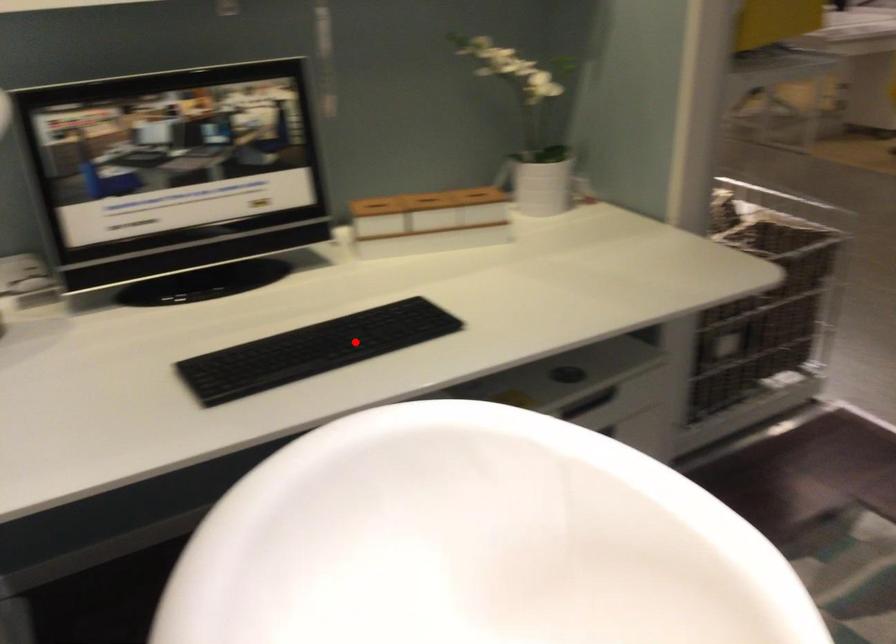
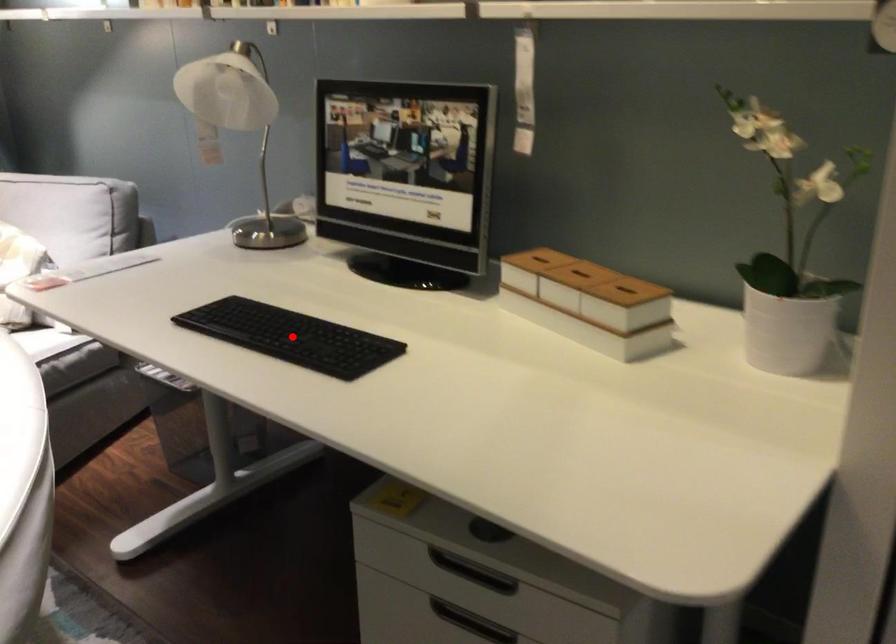
I am providing you with two images of the same scene from different viewpoints. A red point is marked on the first image and another point is marked on the second image. Is the marked point in image1 the same physical position as the marked point in image2?

Yes